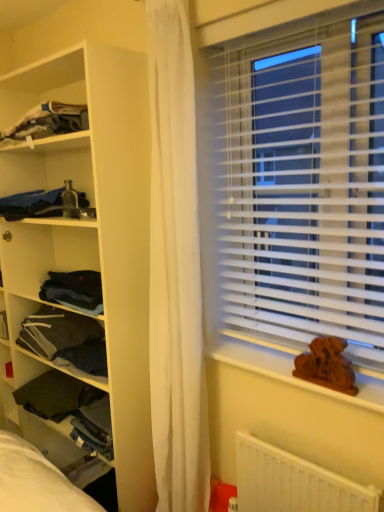
Question: Is dark green fabric at left, acting as the 1th clothing starting from the bottom, taller or shorter than white plastic radiator at lower right?

Choices:
 (A) tall
 (B) short

Answer: (B)

Question: In terms of width, does dark green fabric at left, acting as the fourth clothing starting from the top, look wider or thinner when compared to white plastic radiator at lower right?

Choices:
 (A) wide
 (B) thin

Answer: (A)

Question: Considering the real-world distances, which object is farthest from the white matte shelf at left?

Choices:
 (A) dark gray fabric at left, the 3th clothing from the top
 (B) wooden carving at lower right
 (C) dark green fabric at left, acting as the 1th clothing starting from the bottom
 (D) white plastic radiator at lower right
 (E) dark blue fabric at upper left, arranged as the 1th clothing when viewed from the top

Answer: (D)

Question: Which object is positioned farthest from the wooden carving at lower right?

Choices:
 (A) dark green fabric at left, acting as the 1th clothing starting from the bottom
 (B) white matte shelf at left
 (C) dark blue fabric at upper left, arranged as the 1th clothing when viewed from the top
 (D) dark gray fabric at left, the 3th clothing from the top
 (E) matte black bottle at left, positioned as the second clothing in top-to-bottom order

Answer: (C)